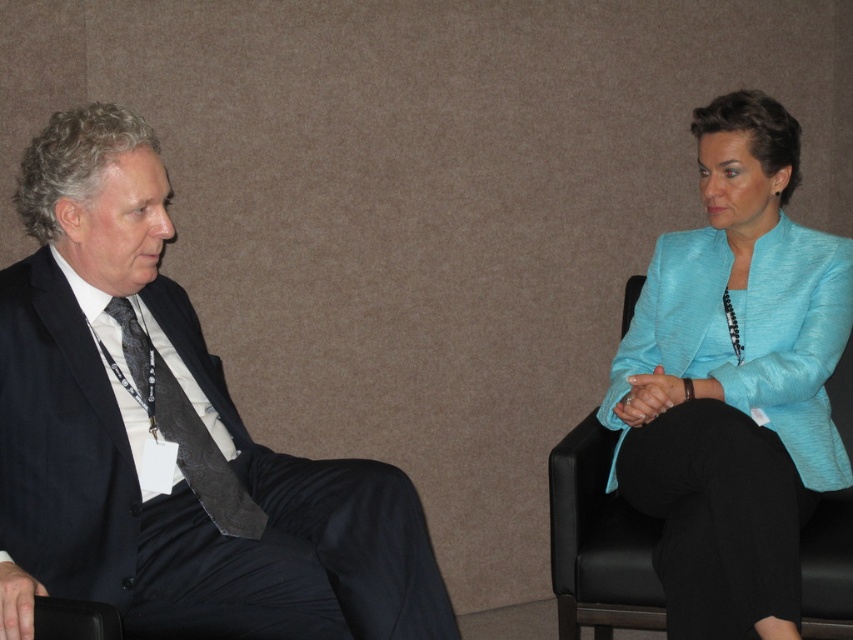
Is dark blue suit at left below turquoise fabric jacket at right?

Yes.

Can you confirm if dark blue suit at left is bigger than turquoise fabric jacket at right?

No, dark blue suit at left is not bigger than turquoise fabric jacket at right.

This screenshot has height=640, width=853. Identify the location of dark blue suit at left. (x=169, y=438).

At what (x,y) coordinates should I click in order to perform the action: click on dark blue suit at left. Please return your answer as a coordinate pair (x, y). Looking at the image, I should click on (169, 438).

Is turquoise fabric jacket at right shorter than dark gray textured tie at left?

No.

How distant is turquoise fabric jacket at right from dark gray textured tie at left?

turquoise fabric jacket at right is 38.52 inches from dark gray textured tie at left.

Who is more distant from viewer, (x=711, y=616) or (x=225, y=506)?

The point (x=711, y=616) is more distant.

In order to click on turquoise fabric jacket at right in this screenshot , I will do click(x=733, y=381).

Can you confirm if dark blue suit at left is positioned below dark gray textured tie at left?

Indeed, dark blue suit at left is positioned under dark gray textured tie at left.

Does dark blue suit at left have a greater height compared to dark gray textured tie at left?

Indeed, dark blue suit at left has a greater height compared to dark gray textured tie at left.

Measure the distance between point (123, 148) and camera.

A distance of 5.07 feet exists between point (123, 148) and camera.

This screenshot has height=640, width=853. Identify the location of dark blue suit at left. (169, 438).